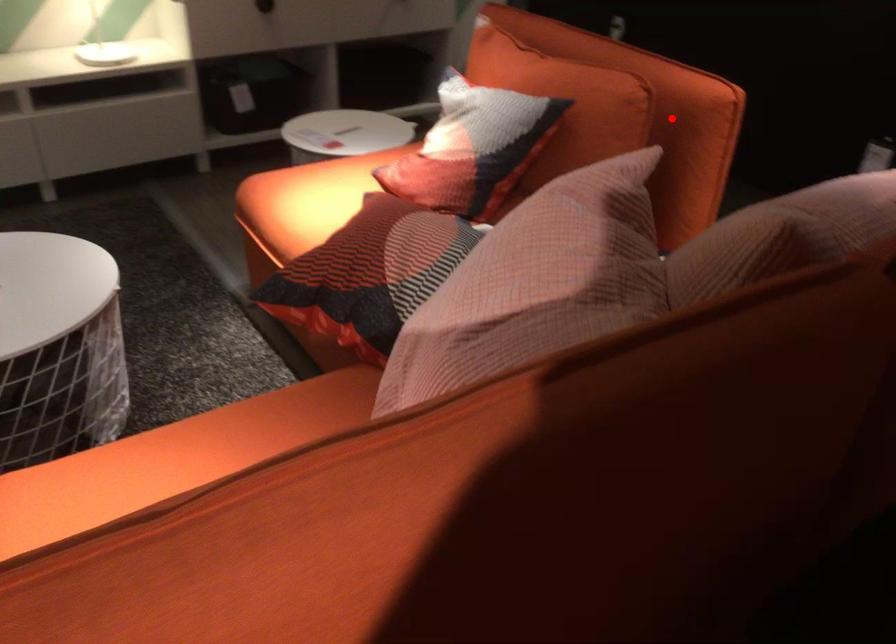
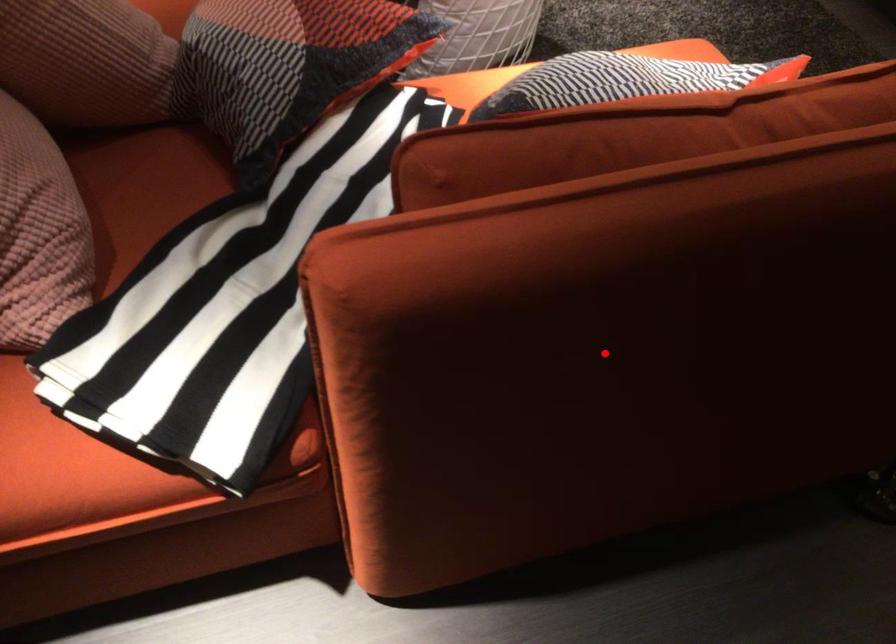
I am providing you with two images of the same scene from different viewpoints. A red point is marked on the first image and another point is marked on the second image. Do the highlighted points in image1 and image2 indicate the same real-world spot?

Yes